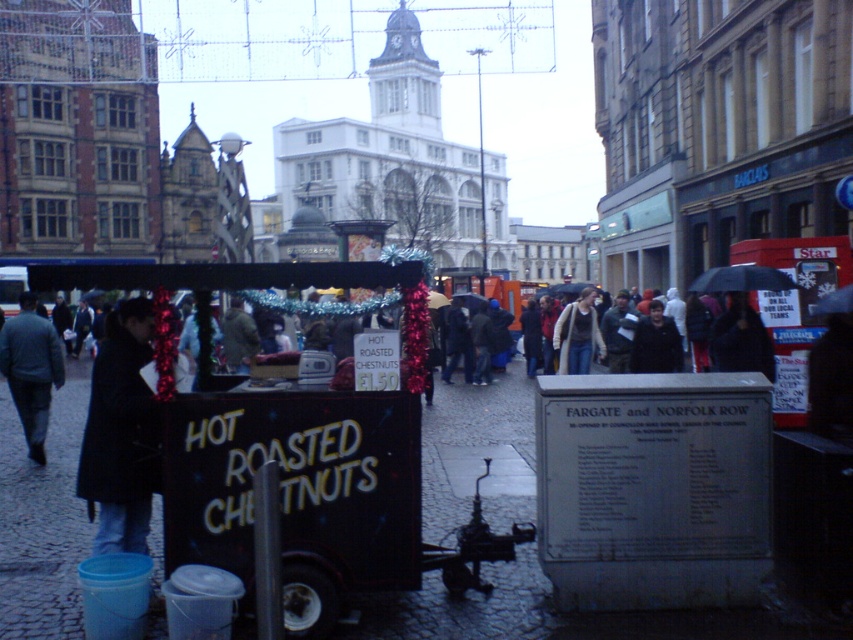
Is dark gray jacket at left further to camera compared to denim jacket at center?

No, dark gray jacket at left is in front of denim jacket at center.

What do you see at coordinates (32, 369) in the screenshot? I see `dark gray jacket at left` at bounding box center [32, 369].

Between point (9, 349) and point (553, 330), which one is positioned in front?

Point (9, 349)

I want to click on dark gray jacket at left, so click(32, 369).